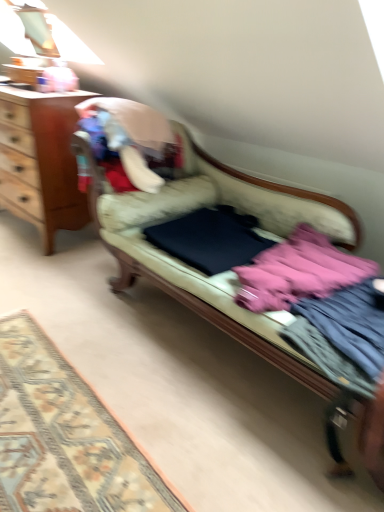
The image size is (384, 512). Describe the element at coordinates (298, 272) in the screenshot. I see `pink fabric at center` at that location.

From the picture: Measure the distance between point (373,314) and camera.

They are 1.38 meters apart.

What do you see at coordinates (351, 324) in the screenshot?
I see `pink fabric at right, acting as the 2th clothing starting from the back` at bounding box center [351, 324].

Image resolution: width=384 pixels, height=512 pixels. Describe the element at coordinates (41, 160) in the screenshot. I see `wooden desk at left` at that location.

The width and height of the screenshot is (384, 512). What are the coordinates of `carpeted rug at lower left` in the screenshot? It's located at (64, 436).

What do you see at coordinates (188, 276) in the screenshot?
I see `velvet beige couch at center` at bounding box center [188, 276].

The image size is (384, 512). What are the coordinates of `dark blue fabric at center, arranged as the second clothing when viewed from the front` in the screenshot? It's located at point(210,239).

Which is behind, wooden desk at left or pink fabric at center?

wooden desk at left is further away from the camera.

Is wooden desk at left situated inside pink fabric at center or outside?

wooden desk at left lies outside pink fabric at center.

Is wooden desk at left facing towards pink fabric at center?

No, wooden desk at left is not aimed at pink fabric at center.

Is velvet beige couch at center shorter than pink fabric at center?

No, velvet beige couch at center is not shorter than pink fabric at center.

Is pink fabric at center a part of velvet beige couch at center?

That's correct, pink fabric at center is inside velvet beige couch at center.

Is velvet beige couch at center to the left or to the right of pink fabric at center in the image?

velvet beige couch at center is positioned on pink fabric at center's left side.

Which of these two, velvet beige couch at center or pink fabric at center, is smaller?

pink fabric at center.

From the image's perspective, is velvet beige couch at center over carpeted rug at lower left?

Correct, velvet beige couch at center appears higher than carpeted rug at lower left in the image.

The image size is (384, 512). Identify the location of mat on the left of velvet beige couch at center. (64, 436).

Is the surface of velvet beige couch at center in direct contact with carpeted rug at lower left?

No, velvet beige couch at center is not with carpeted rug at lower left.

Is velvet beige couch at center facing towards carpeted rug at lower left?

Yes, velvet beige couch at center faces towards carpeted rug at lower left.

Does point (73, 224) lie in front of point (89, 482)?

No, it is behind (89, 482).

Does wooden desk at left have a greater height compared to carpeted rug at lower left?

Correct, wooden desk at left is much taller as carpeted rug at lower left.

Between wooden desk at left and carpeted rug at lower left, which one has smaller size?

carpeted rug at lower left is smaller.

From the image's perspective, which one is positioned lower, wooden desk at left or carpeted rug at lower left?

carpeted rug at lower left, from the image's perspective.

Is pink fabric at center aimed at carpeted rug at lower left?

No, pink fabric at center does not turn towards carpeted rug at lower left.

Based on the photo, between pink fabric at center and carpeted rug at lower left, which one is positioned in front?

carpeted rug at lower left is closer to the camera.

Considering the sizes of objects pink fabric at center and carpeted rug at lower left in the image provided, who is smaller, pink fabric at center or carpeted rug at lower left?

carpeted rug at lower left is smaller.

From a real-world perspective, which object rests below the other?

carpeted rug at lower left is physically lower.

Is dark blue fabric at center, the first clothing viewed from the back, to the left of pink fabric at center from the viewer's perspective?

Yes, dark blue fabric at center, the first clothing viewed from the back, is to the left of pink fabric at center.

Could you tell me if dark blue fabric at center, the first clothing viewed from the back, is turned towards pink fabric at center?

No, dark blue fabric at center, the first clothing viewed from the back, is not facing towards pink fabric at center.

Between dark blue fabric at center, arranged as the second clothing when viewed from the front, and pink fabric at center, which one is positioned behind?

dark blue fabric at center, arranged as the second clothing when viewed from the front.

From the image's perspective, which is below, dark blue fabric at center, arranged as the second clothing when viewed from the front, or pink fabric at center?

pink fabric at center appears lower in the image.

Is wooden desk at left a part of carpeted rug at lower left?

Definitely not — wooden desk at left is not inside carpeted rug at lower left.

From the image's perspective, relative to wooden desk at left, is carpeted rug at lower left above or below?

Based on their image positions, carpeted rug at lower left is located beneath wooden desk at left.

Between carpeted rug at lower left and wooden desk at left, which one has larger size?

wooden desk at left is bigger.

Find the location of a particular element. The image size is (384, 512). baby clothe on the right of wooden desk at left is located at coordinates (298, 272).

At what (x,y) coordinates should I click in order to perform the action: click on studio couch that appears in front of the pink fabric at center. Please return your answer as a coordinate pair (x, y). This screenshot has width=384, height=512. Looking at the image, I should click on (188, 276).

Estimate the real-world distances between objects in this image. Which object is further from dark blue fabric at center, arranged as the second clothing when viewed from the front, pink fabric at center or carpeted rug at lower left?

carpeted rug at lower left lies further to dark blue fabric at center, arranged as the second clothing when viewed from the front, than the other object.

From the image, which object appears to be farther from dark blue fabric at center, the first clothing viewed from the back, pink fabric at right, acting as the 2th clothing starting from the back, or pink fabric at center?

pink fabric at right, acting as the 2th clothing starting from the back.

Looking at the image, which one is located closer to dark blue fabric at center, the first clothing viewed from the back, wooden desk at left or velvet beige couch at center?

velvet beige couch at center is positioned closer to the anchor dark blue fabric at center, the first clothing viewed from the back.

Estimate the real-world distances between objects in this image. Which object is further from carpeted rug at lower left, pink fabric at right, positioned as the first clothing in front-to-back order, or pink fabric at center?

The object further to carpeted rug at lower left is pink fabric at right, positioned as the first clothing in front-to-back order.

When comparing their distances from carpeted rug at lower left, does wooden desk at left or dark blue fabric at center, the first clothing viewed from the back, seem closer?

Among the two, dark blue fabric at center, the first clothing viewed from the back, is located nearer to carpeted rug at lower left.

From the image, which object appears to be farther from carpeted rug at lower left, pink fabric at right, positioned as the first clothing in front-to-back order, or dark blue fabric at center, arranged as the second clothing when viewed from the front?

pink fabric at right, positioned as the first clothing in front-to-back order.

From the picture: Considering their positions, is dark blue fabric at center, arranged as the second clothing when viewed from the front, positioned closer to pink fabric at right, acting as the 2th clothing starting from the back, than carpeted rug at lower left?

dark blue fabric at center, arranged as the second clothing when viewed from the front.

Which object lies further to the anchor point pink fabric at right, positioned as the first clothing in front-to-back order, dark blue fabric at center, the first clothing viewed from the back, or velvet beige couch at center?

Among the two, dark blue fabric at center, the first clothing viewed from the back, is located further to pink fabric at right, positioned as the first clothing in front-to-back order.

The height and width of the screenshot is (512, 384). What are the coordinates of `clothing between velvet beige couch at center and dark blue fabric at center, arranged as the second clothing when viewed from the front, along the z-axis` in the screenshot? It's located at (351, 324).

The height and width of the screenshot is (512, 384). I want to click on clothing situated between wooden desk at left and pink fabric at center from left to right, so click(x=210, y=239).

You are a GUI agent. You are given a task and a screenshot of the screen. Output one action in this format:
    pyautogui.click(x=<x>, y=<y>)
    Task: Click on the mat between wooden desk at left and pink fabric at center in the horizontal direction
    The height and width of the screenshot is (512, 384).
    Given the screenshot: What is the action you would take?
    pyautogui.click(x=64, y=436)

Locate an element on the screen. This screenshot has height=512, width=384. baby clothe located between dark blue fabric at center, the first clothing viewed from the back, and pink fabric at right, positioned as the first clothing in front-to-back order, in the left-right direction is located at coordinates (298, 272).